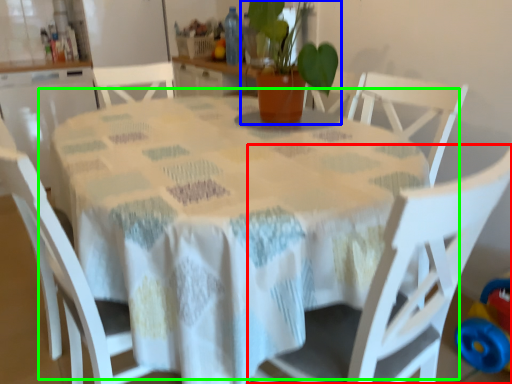
Question: Estimate the real-world distances between objects in this image. Which object is farther from chair (highlighted by a red box), houseplant (highlighted by a blue box) or table (highlighted by a green box)?

Choices:
 (A) houseplant
 (B) table

Answer: (A)